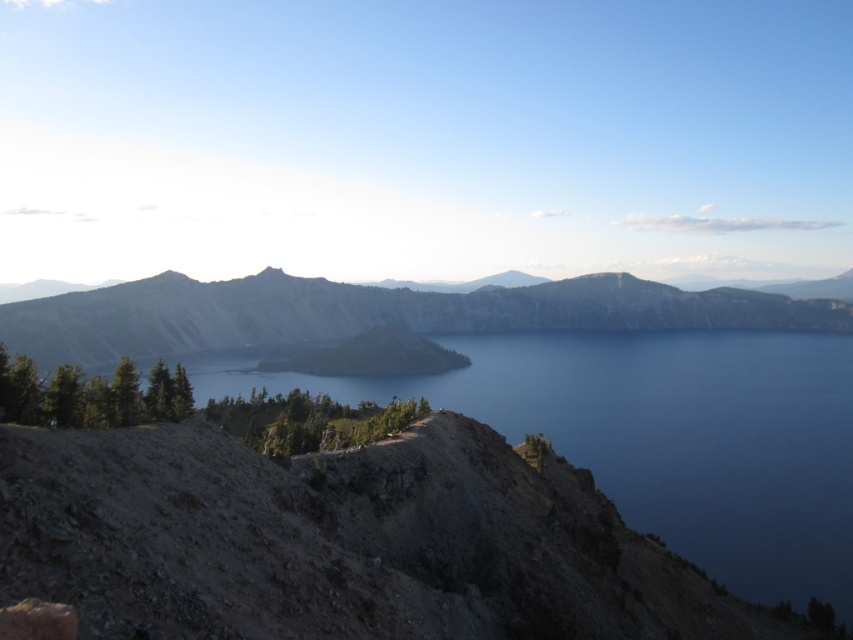
You are a hiker who wants to take a photo of the blue water at center and the gray rocky mountain at center. Which one should you zoom in on to capture both objects in the frame without moving your camera?

The blue water at center has a smaller size compared to gray rocky mountain at center, so you should zoom in on the gray rocky mountain at center to ensure both objects fit in the frame.

You are standing at the edge of the volcanic crater lake and looking out toward the mountains. There are two points marked in the image. One is at coordinate point (807, 403) and the other is at point (173, 288). Which point is closer to you?

Point (807, 403) is closer to the camera than point (173, 288).